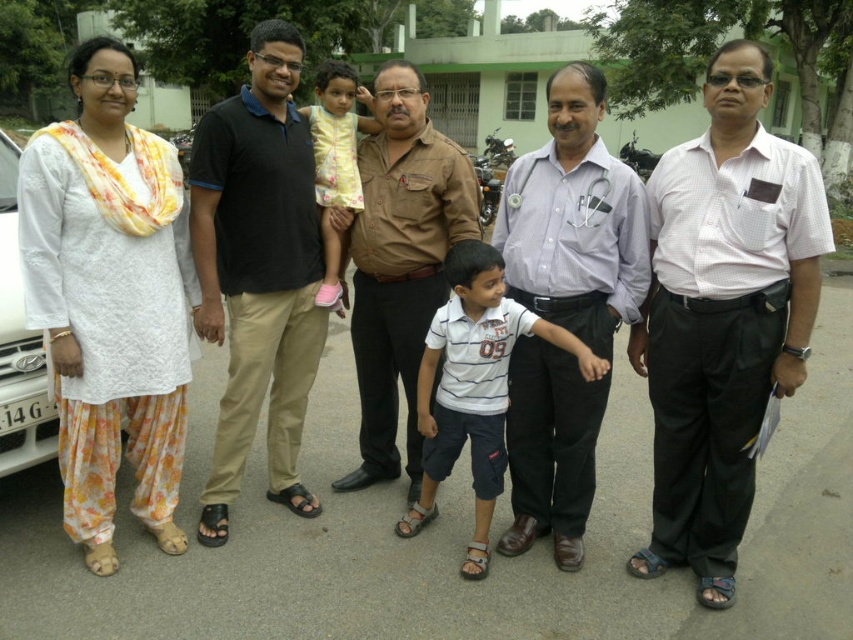
In the scene shown: You are organizing a group photo and need to arrange two people wearing the white cotton shirt at center and the yellow floral dress at center side by side. Based on their clothing widths, which person should stand on the left to ensure both fit within a 2m wide frame?

The white cotton shirt at center is wider than the yellow floral dress at center. To fit both within the 2m frame, the narrower yellow floral dress at center should be placed on the left, allowing the wider white cotton shirt at center to occupy the remaining space on the right.

Consider the image. You are organizing a group photo and need to arrange the people so that the taller individual stands behind the shorter one. Given that you have the white cotton shirt at center and the yellow floral dress at center in the image, which one should be placed behind the other?

The white cotton shirt at center is taller than the yellow floral dress at center, so the white cotton shirt at center should be placed behind the yellow floral dress at center to ensure the shorter person is in front.